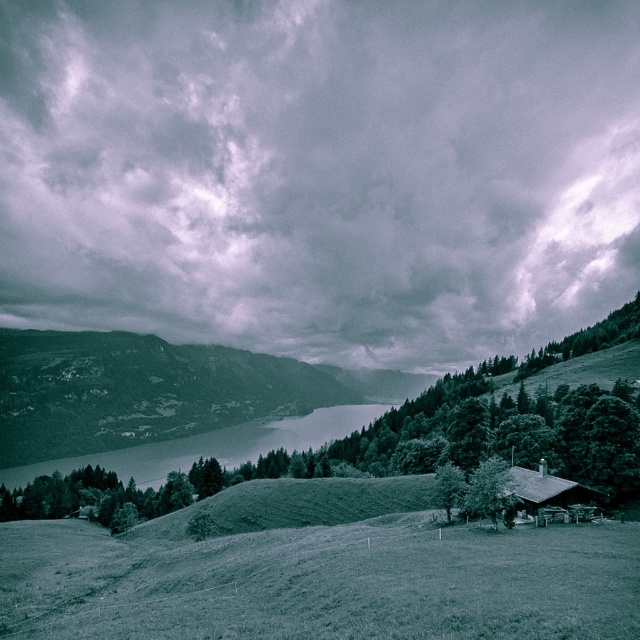
Looking at this image, you are standing on the grassy slope near the rustic wooden house and want to reach the smooth water at center. Which direction should you walk to avoid the green leafy tree at lower right?

The smooth water at center is to the left of green leafy tree at lower right, so to reach the smooth water at center while avoiding the green leafy tree at lower right, you should walk towards the left direction from your current position near the house.